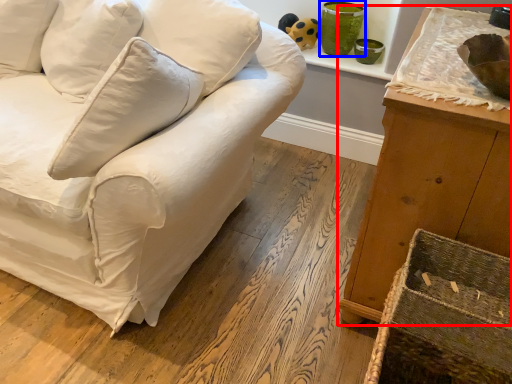
Question: Which object is further to the camera taking this photo, furniture (highlighted by a red box) or glass vase (highlighted by a blue box)?

Choices:
 (A) furniture
 (B) glass vase

Answer: (B)